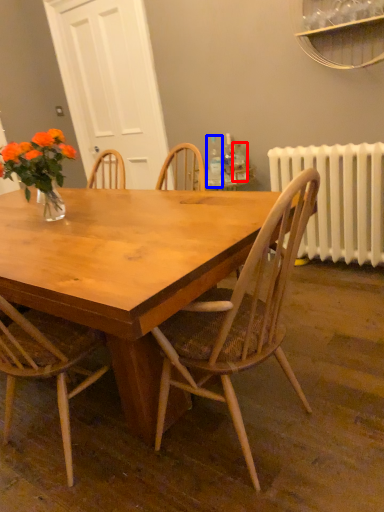
Question: Which object is closer to the camera taking this photo, bottle (highlighted by a red box) or bottle (highlighted by a blue box)?

Choices:
 (A) bottle
 (B) bottle

Answer: (B)